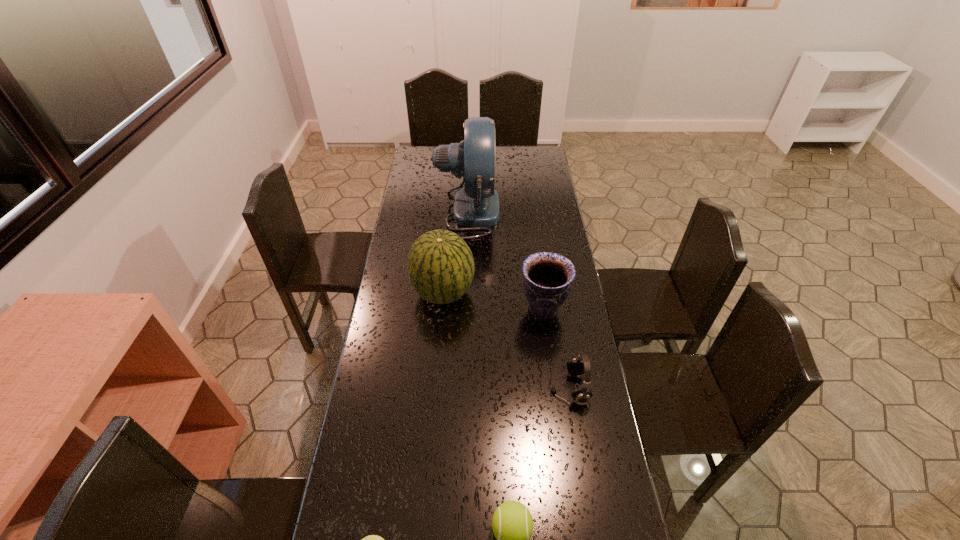
I want to click on vacant space at the right edge of the desktop, so click(x=545, y=212).

Locate an element on the screen. Image resolution: width=960 pixels, height=540 pixels. vacant space at the far left corner is located at coordinates (421, 165).

The image size is (960, 540). In order to click on free space at the far right corner in this screenshot , I will do `click(544, 146)`.

I want to click on vacant space that is in between the headset and the second tallest object, so click(x=506, y=341).

Where is `free space between the fan and the fourth tallest object`? free space between the fan and the fourth tallest object is located at coordinates (518, 300).

Where is `the fourth closest object to the left tennis ball`? This screenshot has width=960, height=540. the fourth closest object to the left tennis ball is located at coordinates (547, 279).

Locate an element on the screen. The height and width of the screenshot is (540, 960). object that is the fifth closest to the fan is located at coordinates (371, 539).